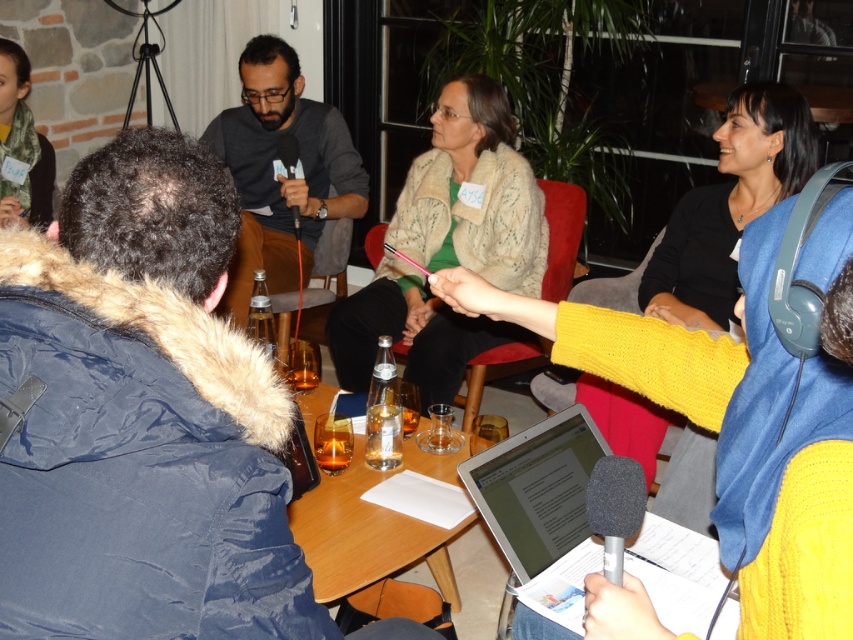
You are organizing a photo shoot and need to ensure that all participants are visible in the frame. Given that the camera has a zoom lens that can only focus on objects within a 1.2 meter height range, will the dark gray matte shirt at center and the matte black jacket at upper left both be in focus?

The dark gray matte shirt at center is larger in size than the matte black jacket at upper left. Since the camera can focus on objects within a 1.2 meter height range, and the size difference may affect their positions in the frame, both should be within the focus range as long as their actual heights are within the specified limit. However, without exact measurements, it is recommended to adjust the zoom to ensure both are clearly visible.

In the scene shown: You are attending a meeting and need to locate the person wearing the dark gray matte shirt at center. Where would you look relative to the person in the matte black jacket at upper left?

The dark gray matte shirt at center is located below the matte black jacket at upper left, so you should look downward from the matte black jacket at upper left to find the person in the dark gray matte shirt at center.

You are standing in the room and want to move from point A to point B. Point A is at coordinates point (302, 278) and point B is at coordinates point (16, 161). Which direction should you move to go from point A to point B?

To move from point A at coordinates point (302, 278) to point B at coordinates point (16, 161), you should move towards the lower left direction since point B is closer to the camera compared to point A.